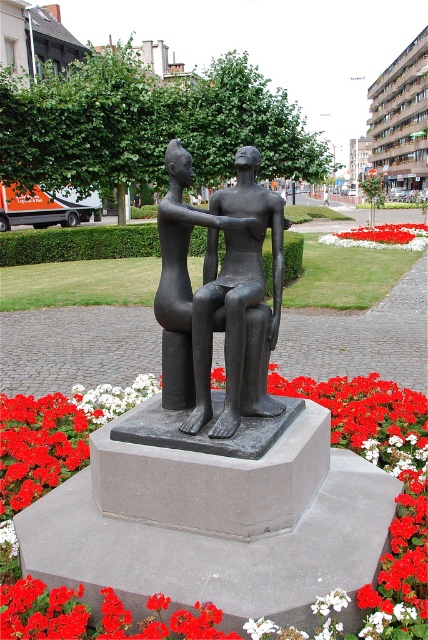
Question: Does red matte flower at center have a larger size compared to white fabric flower at lower center?

Choices:
 (A) no
 (B) yes

Answer: (A)

Question: Considering the real-world distances, which object is farthest from the white fabric flower at lower center?

Choices:
 (A) red matte flower at center
 (B) bronze statue at center

Answer: (B)

Question: Among these points, which one is nearest to the camera?

Choices:
 (A) (213, 276)
 (B) (389, 236)

Answer: (A)

Question: In this image, where is bronze statue at center located relative to white fabric flower at lower center?

Choices:
 (A) left
 (B) right

Answer: (A)

Question: Which point is farther to the camera?

Choices:
 (A) (421, 241)
 (B) (403, 540)
 (C) (276, 336)

Answer: (A)

Question: Does bronze statue at center have a larger size compared to white fabric flower at lower center?

Choices:
 (A) yes
 (B) no

Answer: (B)